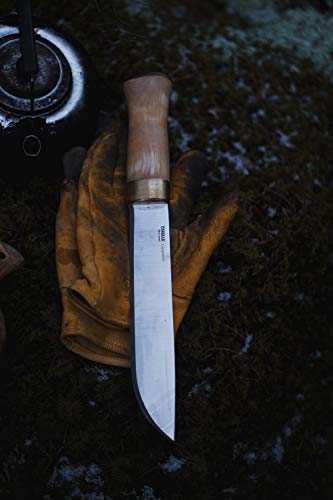
Where is `handle`? handle is located at coordinates (152, 120).